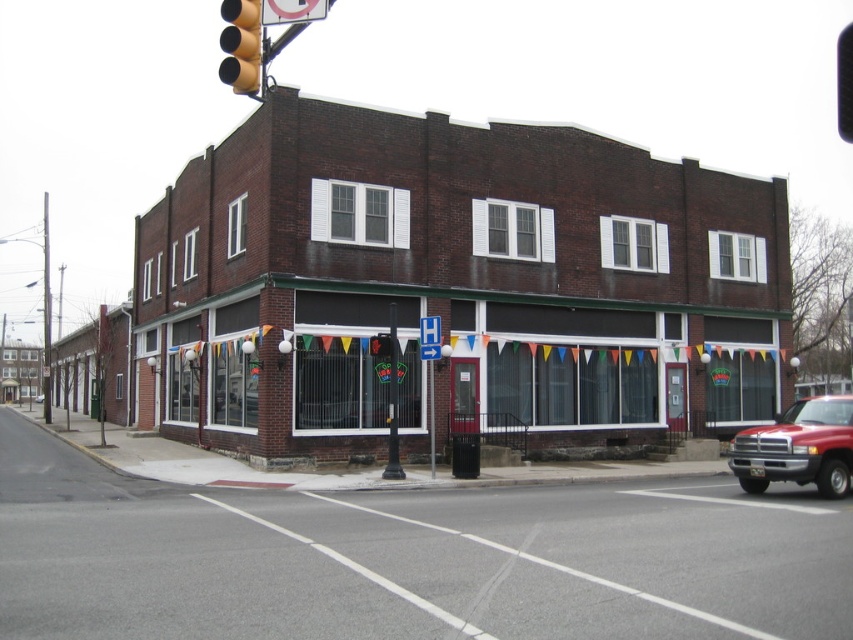
Can you confirm if black metal pole at center is bigger than red matte truck at center?

No.

Who is more distant from viewer, (386, 472) or (41, 400)?

Point (41, 400)

Is point (392, 412) farther from viewer compared to point (39, 396)?

No, it is not.

The image size is (853, 640). In order to click on black metal pole at center in this screenshot , I will do `click(393, 403)`.

Is white plastic sign at upper center below metallic pole at center?

No, white plastic sign at upper center is not below metallic pole at center.

Does white plastic sign at upper center have a lesser width compared to metallic pole at center?

No, white plastic sign at upper center is not thinner than metallic pole at center.

Does point (302, 3) come closer to viewer compared to point (430, 476)?

Yes, point (302, 3) is in front of point (430, 476).

You are a GUI agent. You are given a task and a screenshot of the screen. Output one action in this format:
    pyautogui.click(x=<x>, y=<y>)
    Task: Click on the white plastic sign at upper center
    
    Given the screenshot: What is the action you would take?
    pyautogui.click(x=292, y=10)

How far apart are brown brick building at center and black metal pole at center?

They are 9.70 meters apart.

In the scene shown: Is brown brick building at center closer to camera compared to black metal pole at center?

That is False.

This screenshot has height=640, width=853. Describe the element at coordinates (457, 284) in the screenshot. I see `brown brick building at center` at that location.

Locate an element on the screen. This screenshot has width=853, height=640. brown brick building at center is located at coordinates (457, 284).